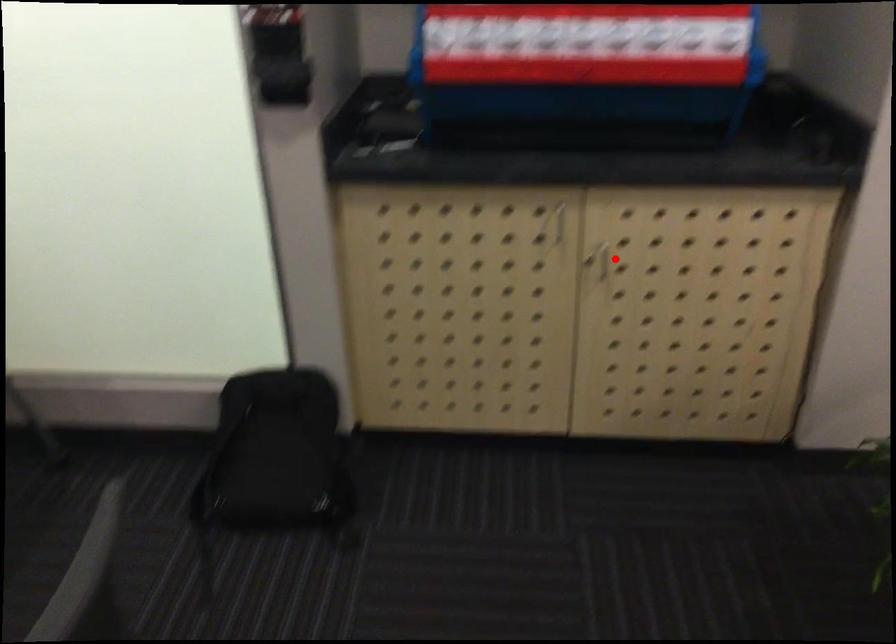
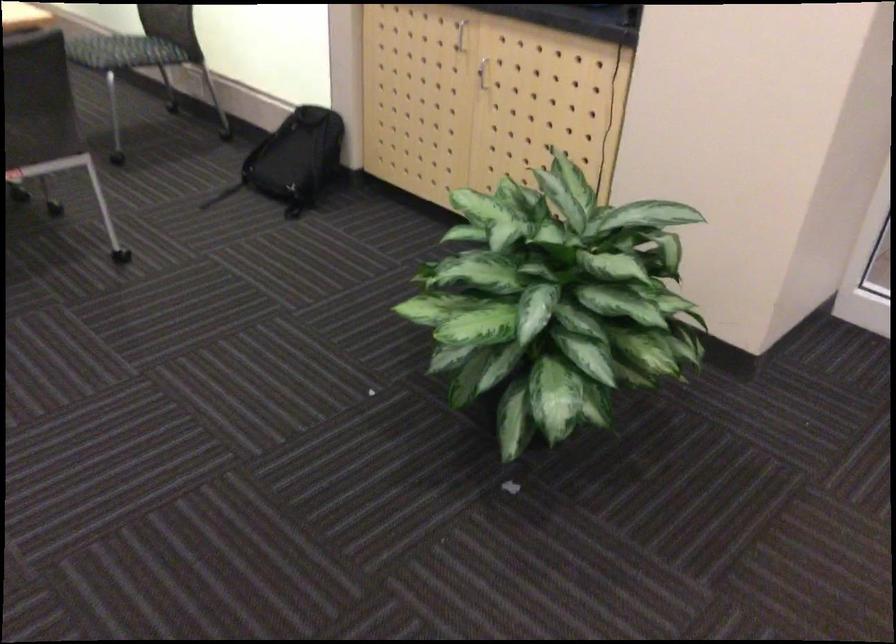
Question: I am providing you with two images of the same scene from different viewpoints. Given a red point in image1, look at the same physical point in image2. Is it:

Choices:
 (A) Closer to the viewpoint
 (B) Farther from the viewpoint

Answer: (B)